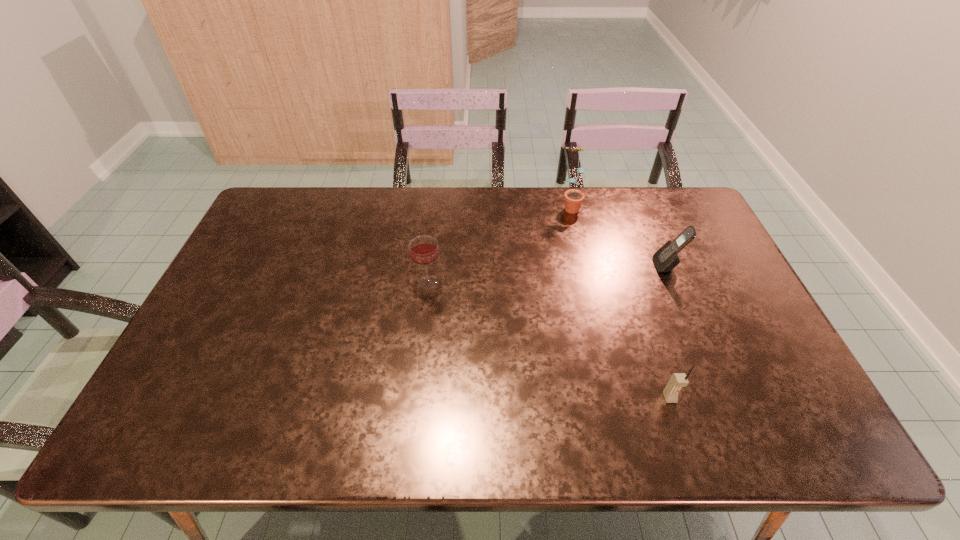
Find the location of a particular element. This screenshot has height=540, width=960. free region located 0.070m on the front-facing side of the farther cellular telephone is located at coordinates click(632, 266).

Identify the location of vacant point located 0.200m on the right of the wineglass. This screenshot has width=960, height=540. (510, 282).

The image size is (960, 540). Identify the location of object situated at the far edge. (573, 198).

I want to click on object located in the right edge section of the desktop, so click(x=666, y=258).

Find the location of `free space at the far edge`. free space at the far edge is located at coordinates (603, 207).

What are the coordinates of `vacant space at the near edge of the desktop` in the screenshot? It's located at (543, 443).

Identify the location of blank area at the left edge. The height and width of the screenshot is (540, 960). (176, 366).

Locate an element on the screen. free space at the right edge is located at coordinates (747, 343).

In the image, there is a desktop. What are the coordinates of `vacant space at the far right corner` in the screenshot? It's located at (677, 220).

Locate an element on the screen. This screenshot has width=960, height=540. vacant space that's between the nearest object and the leftmost object is located at coordinates (549, 340).